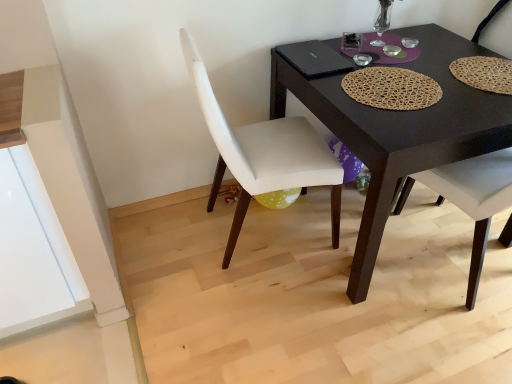
Question: From a real-world perspective, is black matte desk at center physically located above or below white leather chair at center, which is the 1th chair from left to right?

Choices:
 (A) below
 (B) above

Answer: (A)

Question: Considering the positions of point (434, 74) and point (257, 155), is point (434, 74) closer or farther from the camera than point (257, 155)?

Choices:
 (A) farther
 (B) closer

Answer: (B)

Question: Based on their relative distances, which object is nearer to the black matte laptop at upper center?

Choices:
 (A) matte white chair at right, which appears as the first chair when viewed from the right
 (B) white leather chair at center, the second chair positioned from the right
 (C) black matte desk at center

Answer: (C)

Question: Considering the real-world distances, which object is farthest from the matte white chair at right, which appears as the first chair when viewed from the right?

Choices:
 (A) black matte laptop at upper center
 (B) black matte desk at center
 (C) white leather chair at center, the second chair positioned from the right

Answer: (A)